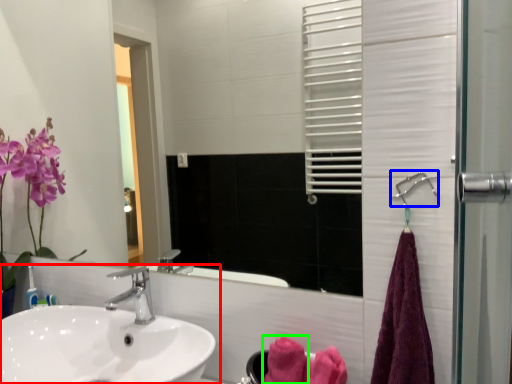
Question: Which object is positioned closest to sink (highlighted by a red box)? Select from shower (highlighted by a blue box) and bath towel (highlighted by a green box).

Choices:
 (A) shower
 (B) bath towel

Answer: (B)